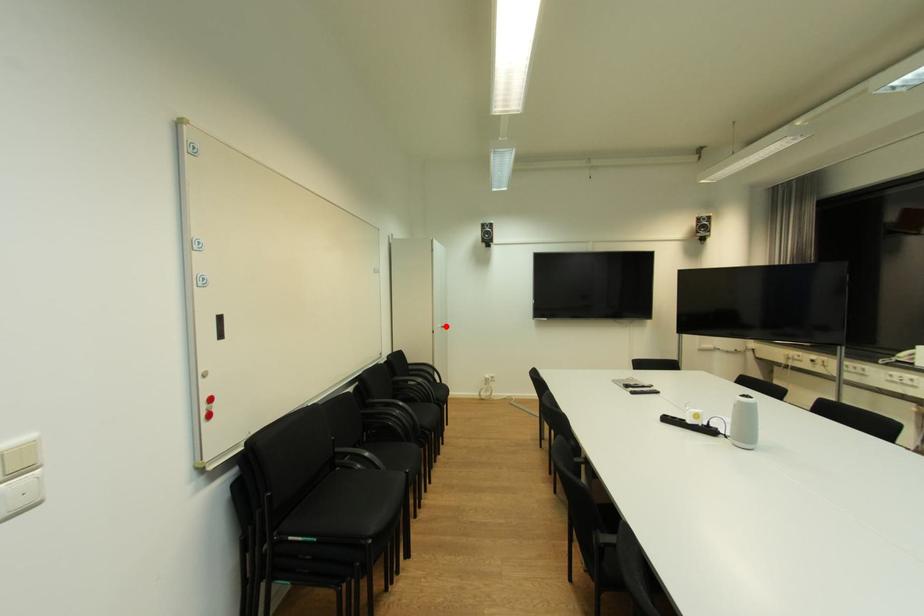
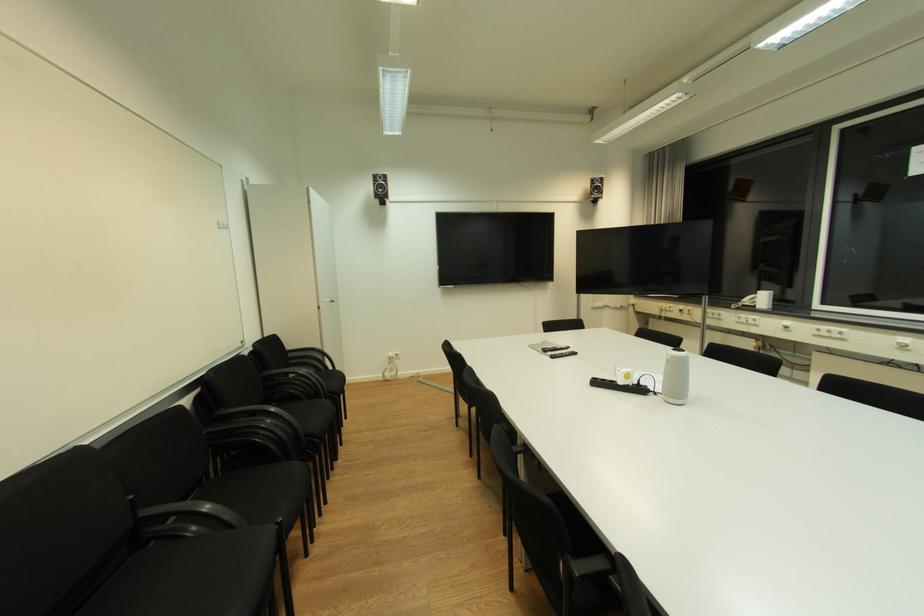
Where in the second image is the point corresponding to the highlighted location from the first image?

(334, 301)